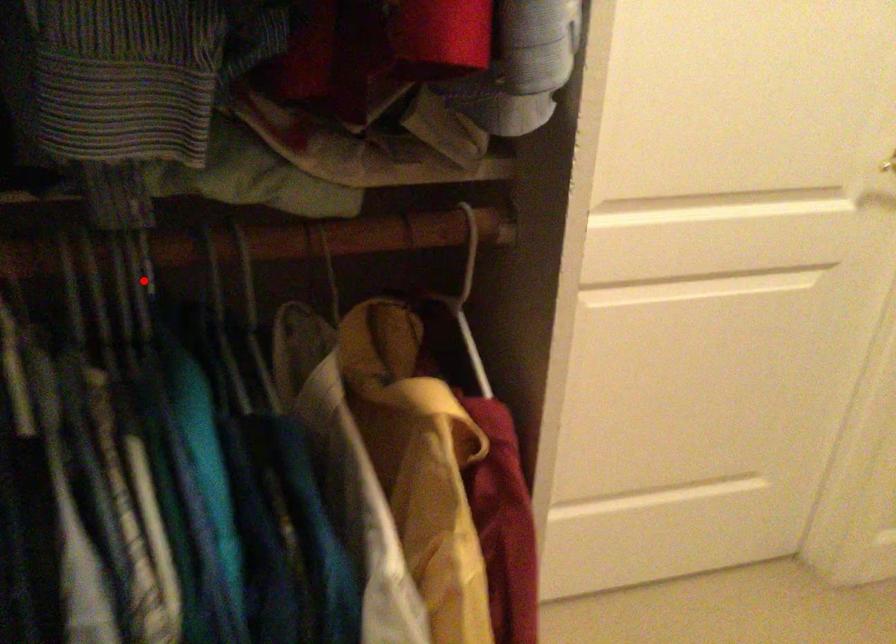
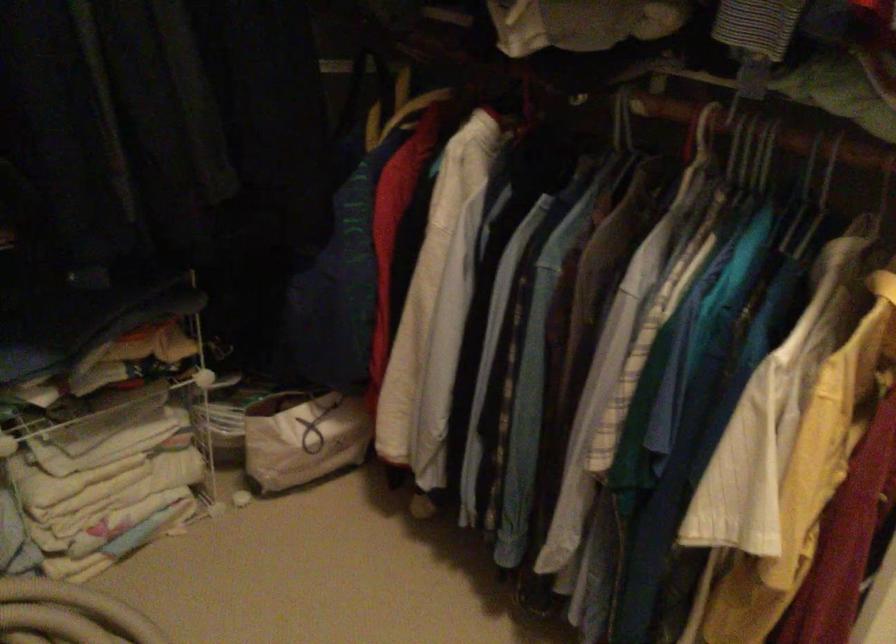
Locate, in the second image, the point that corresponds to the highlighted location in the first image.

(767, 154)